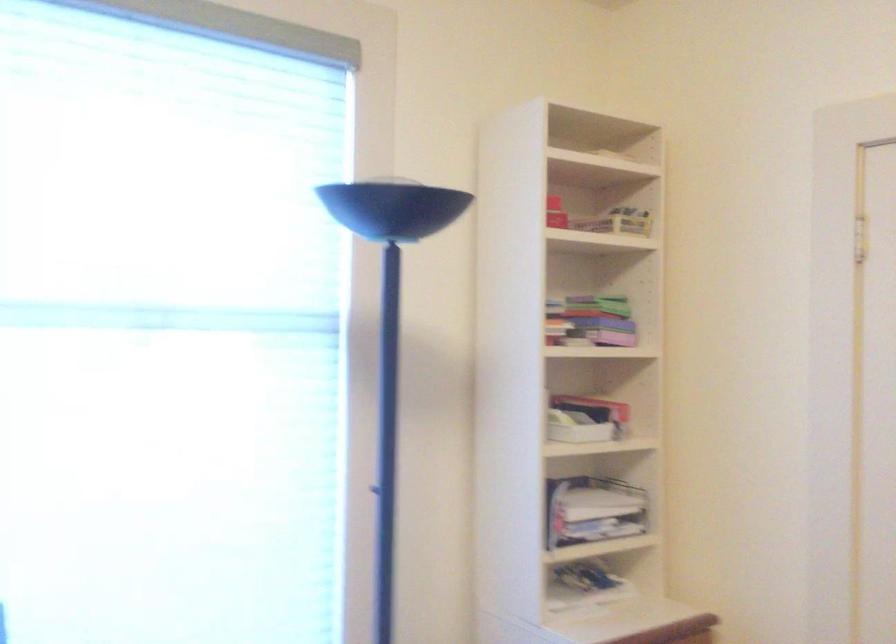
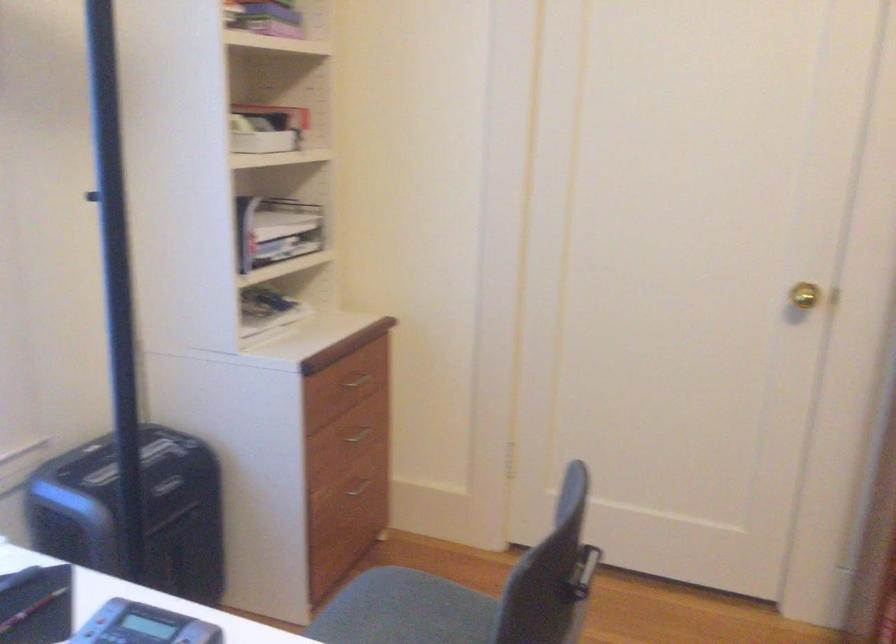
How did the camera likely rotate?

The rotation direction of the camera is right-down.